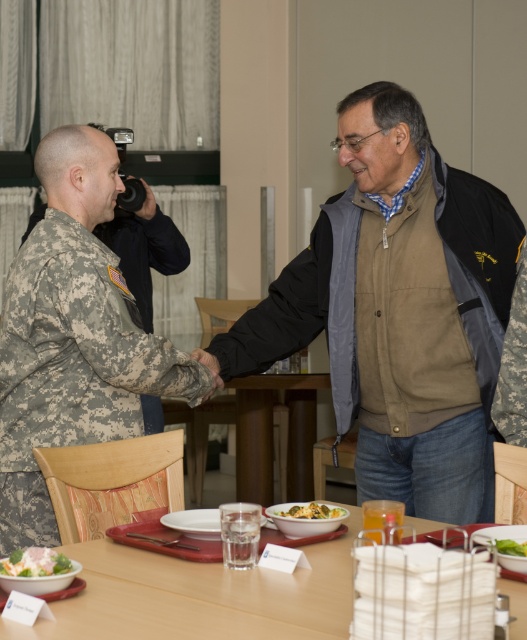
Question: Which is nearer to the yellowish matte pasta at center?

Choices:
 (A) camouflage fabric uniform at left
 (B) green leafy salad at lower center
 (C) wooden table at lower center

Answer: (C)

Question: Is camouflage fabric uniform at left closer to the viewer compared to green leafy salad at lower center?

Choices:
 (A) no
 (B) yes

Answer: (A)

Question: Is wooden table at lower center wider than green leafy salad at lower center?

Choices:
 (A) yes
 (B) no

Answer: (A)

Question: Which of the following is the closest to the observer?

Choices:
 (A) white creamy salad at lower left
 (B) wooden table at lower center
 (C) brown suede vest at center

Answer: (B)

Question: Does camouflage fabric uniform at left appear over white creamy salad at lower left?

Choices:
 (A) yes
 (B) no

Answer: (A)

Question: Estimate the real-world distances between objects in this image. Which object is closer to the white creamy salad at lower left?

Choices:
 (A) wooden table at lower center
 (B) camouflage fabric uniform at left
 (C) green leafy salad at lower center
 (D) brown suede vest at center

Answer: (A)